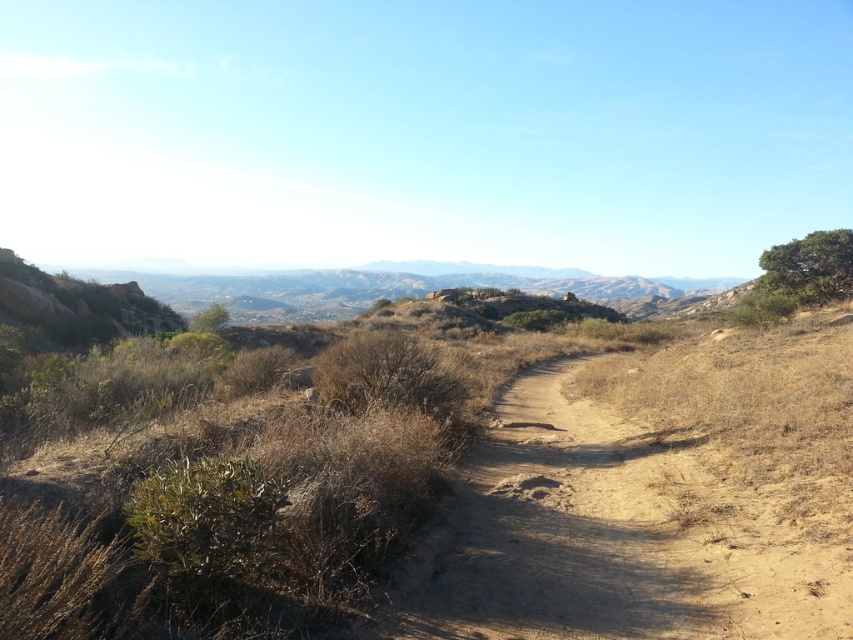
Is dried dirt path at center thinner than green leafy tree at upper right?

No, dried dirt path at center is not thinner than green leafy tree at upper right.

Between dried dirt path at center and green leafy tree at upper right, which one appears on the right side from the viewer's perspective?

From the viewer's perspective, green leafy tree at upper right appears more on the right side.

Which is in front, point (683, 572) or point (787, 252)?

Point (683, 572) is more forward.

Where is `dried dirt path at center`? dried dirt path at center is located at coordinates (553, 536).